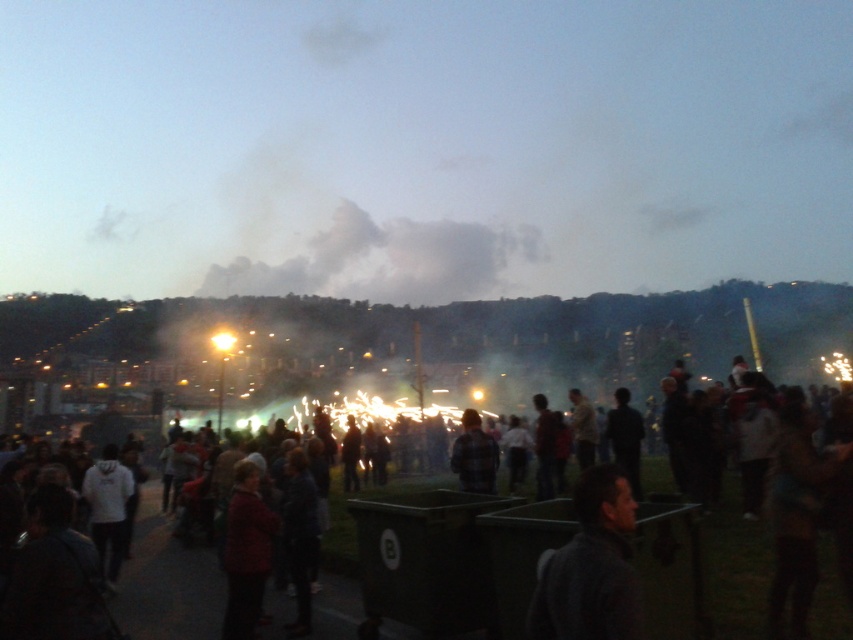
You are standing at the edge of the scene and want to approach both the dark clothing crowd at center and the plaid fabric shirt at center. Which one will you reach first?

You will reach the dark clothing crowd at center first because it is closer to you than the plaid fabric shirt at center, which is further away.